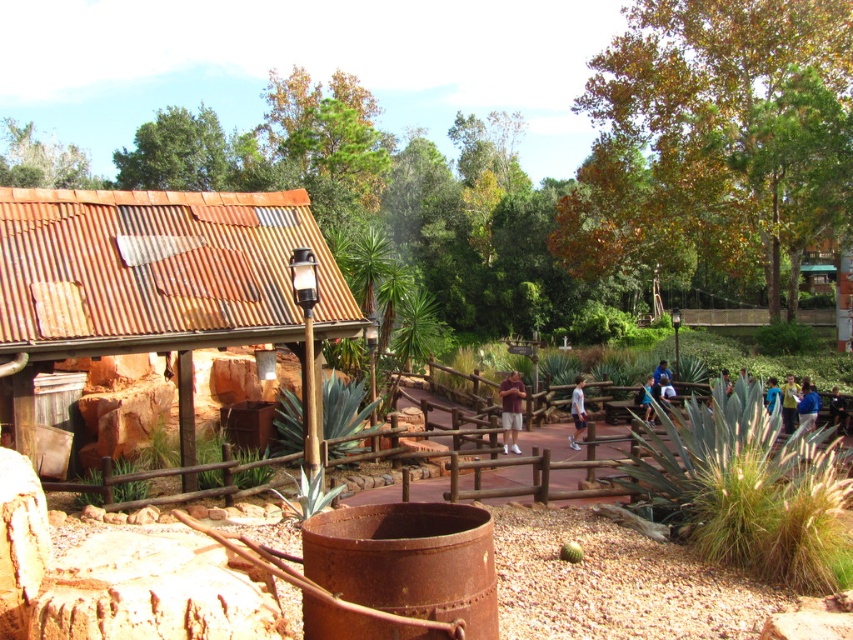
You are standing at the center of the path in the rustic outdoor setting. There is a wooden fence along the path. You see a point marked at coordinates [154,282]. Which object does this point correspond to?

The point at coordinates [154,282] corresponds to the rusty corrugated metal hut at left.